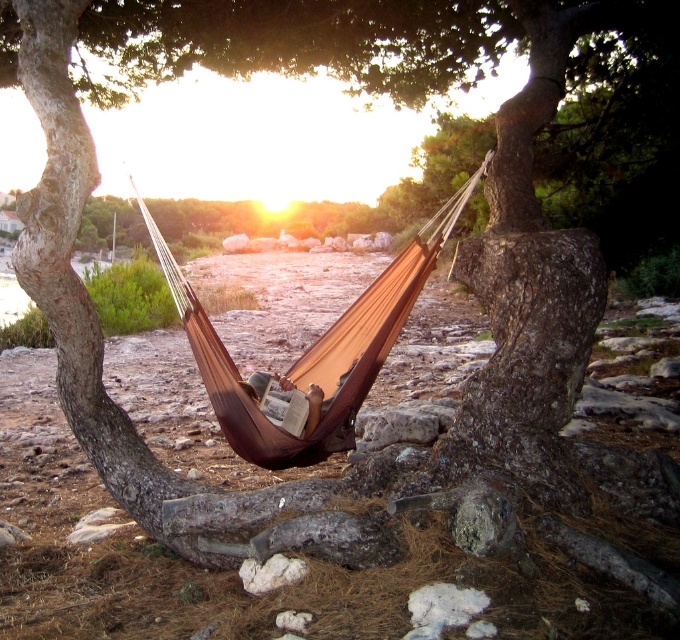
You are planning to install a new light fixture in the scene. The light needs to be placed above the brown fabric hammock at center to provide evening illumination. Given that the light must be positioned at coordinates that are 0.05 units higher and 0.02 units to the right of the hammock, what are the new coordinates for the light fixture?

The brown fabric hammock at center is located at point (309, 355). Adding 0.05 to the y coordinate and 0.02 to the x coordinate, the new coordinates for the light fixture would be (343, 369).

You are standing in the serene outdoor scene and want to place a small decorative rock between the two points marked as point (256, 442) and point (307, 388). Which point should you place it closer to in order for it to appear closer to you?

You should place the decorative rock closer to point (256, 442) because it is closer to the viewer than point (307, 388).